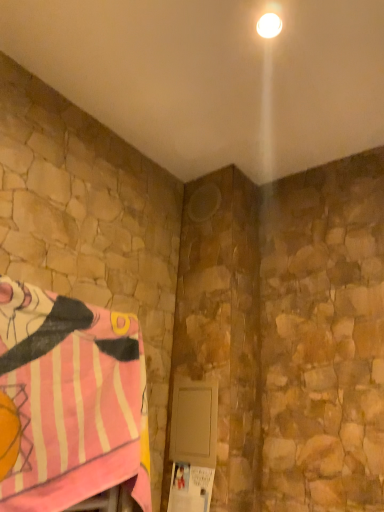
Image resolution: width=384 pixels, height=512 pixels. What are the coordinates of `pink fabric blanket at lower left` in the screenshot? It's located at (69, 401).

In order to face pink fabric blanket at lower left, should I rotate leftwards or rightwards?

To face it directly, rotate left by 18.082 degrees.

The width and height of the screenshot is (384, 512). What do you see at coordinates (69, 401) in the screenshot?
I see `pink fabric blanket at lower left` at bounding box center [69, 401].

Identify the location of pink fabric blanket at lower left. The width and height of the screenshot is (384, 512). (69, 401).